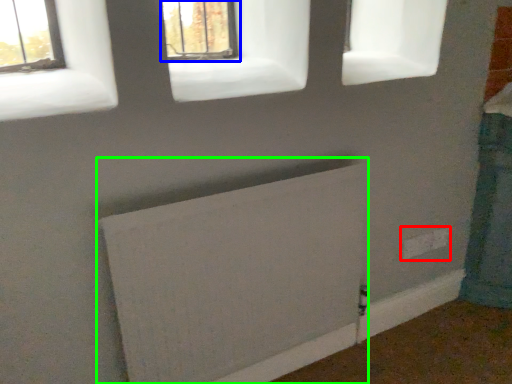
Question: Which object is positioned farthest from electric outlet (highlighted by a red box)? Select from window (highlighted by a blue box) and radiator (highlighted by a green box).

Choices:
 (A) window
 (B) radiator

Answer: (A)